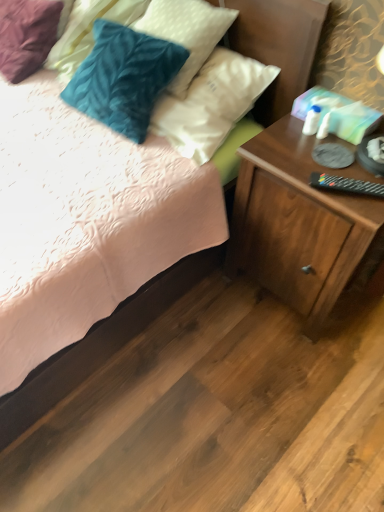
Question: Considering the relative sizes of black plastic remote control at right and velvety teal pillow at upper left, the 2th pillow viewed from the right, in the image provided, is black plastic remote control at right wider than velvety teal pillow at upper left, the 2th pillow viewed from the right,?

Choices:
 (A) no
 (B) yes

Answer: (A)

Question: Does black plastic remote control at right come behind velvety teal pillow at upper left, the first pillow in the left-to-right sequence?

Choices:
 (A) no
 (B) yes

Answer: (A)

Question: Is velvety teal pillow at upper left, the first pillow in the left-to-right sequence, inside black plastic remote control at right?

Choices:
 (A) yes
 (B) no

Answer: (B)

Question: From the image's perspective, would you say black plastic remote control at right is positioned over velvety teal pillow at upper left, the first pillow in the left-to-right sequence?

Choices:
 (A) no
 (B) yes

Answer: (A)

Question: Is black plastic remote control at right bigger than velvety teal pillow at upper left, the first pillow in the left-to-right sequence?

Choices:
 (A) yes
 (B) no

Answer: (B)

Question: Does black plastic remote control at right appear on the right side of velvety teal pillow at upper left, the first pillow in the left-to-right sequence?

Choices:
 (A) yes
 (B) no

Answer: (A)

Question: Does velvety blue pillow at upper left, the 2th pillow from the left, turn towards black plastic remote control at right?

Choices:
 (A) yes
 (B) no

Answer: (B)

Question: Considering the relative sizes of velvety blue pillow at upper left, the 2th pillow from the left, and black plastic remote control at right in the image provided, is velvety blue pillow at upper left, the 2th pillow from the left, bigger than black plastic remote control at right?

Choices:
 (A) yes
 (B) no

Answer: (A)

Question: From a real-world perspective, is velvety blue pillow at upper left, which is the first pillow in right-to-left order, located beneath black plastic remote control at right?

Choices:
 (A) no
 (B) yes

Answer: (A)

Question: Does velvety blue pillow at upper left, which is the first pillow in right-to-left order, have a lesser height compared to black plastic remote control at right?

Choices:
 (A) no
 (B) yes

Answer: (A)

Question: Is the position of velvety blue pillow at upper left, the 2th pillow from the left, more distant than that of black plastic remote control at right?

Choices:
 (A) yes
 (B) no

Answer: (A)

Question: From the image's perspective, is velvety blue pillow at upper left, the 2th pillow from the left, below black plastic remote control at right?

Choices:
 (A) no
 (B) yes

Answer: (A)

Question: Is the position of wooden nightstand at lower right less distant than that of black plastic remote control at right?

Choices:
 (A) no
 (B) yes

Answer: (B)